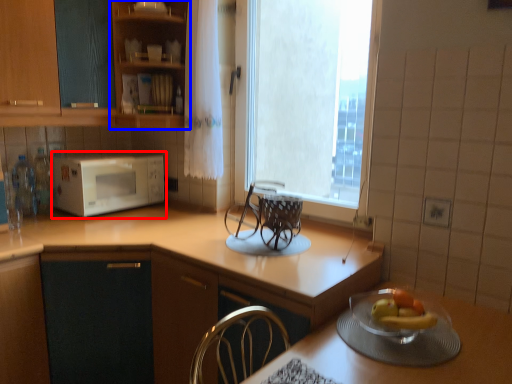
Question: Among these objects, which one is farthest to the camera, microwave oven (highlighted by a red box) or cabinetry (highlighted by a blue box)?

Choices:
 (A) microwave oven
 (B) cabinetry

Answer: (A)